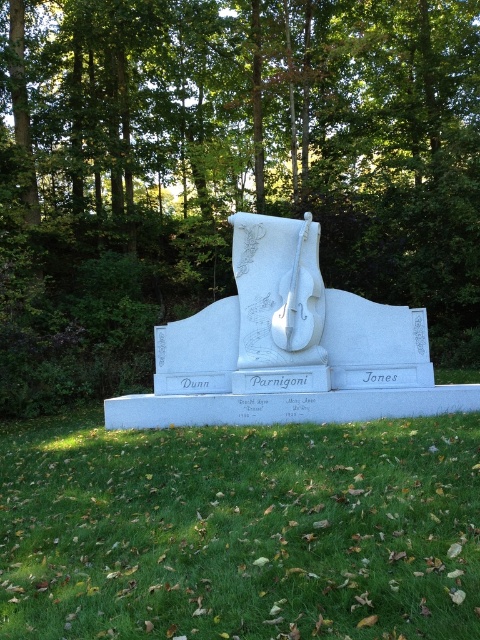
You are a landscape architect designing a garden path that needs to pass between the green leafy tree at center and the green grass at lower center. Since the path must be elevated to avoid damaging the grass, how should you position the elevated walkway to ensure it doesn

The green leafy tree at center is taller than the green grass at lower center, so the elevated walkway should be positioned above the grass but below the tree to avoid obstruction while protecting the grass.

You are standing in front of the monument and want to take a photo of the monument with the green leafy tree at center in the background. Where should you position yourself relative to the monument to ensure the tree is fully visible in the background?

Position yourself directly in front of the monument, aligned with the green leafy tree at center located at coordinates point (x=226, y=168) to ensure the tree is fully visible in the background.

You are a landscape architect designing a garden path that needs to be 3 meters wide. You observe the green leafy tree at center and the green grass at lower center in the scene. Can the space between these two elements accommodate the path?

The green leafy tree at center is bigger than green grass at lower center, but the description does not provide specific measurements about the distance between them. Therefore, it is uncertain if the 3 meter wide path can fit between them.